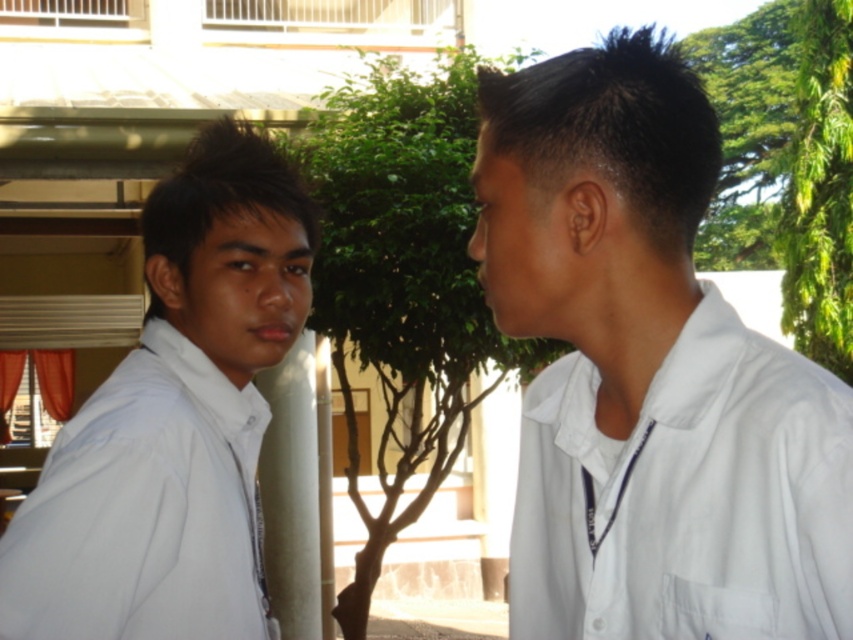
You are a photographer trying to capture both individuals in a single frame. Given that the white matte shirt at center is not as tall as the white matte shirt at left, which person should you position closer to the camera to ensure both are fully visible in the photo?

Position the white matte shirt at center closer to the camera since it is shorter than the white matte shirt at left. This way, both will be visible without one blocking the other.